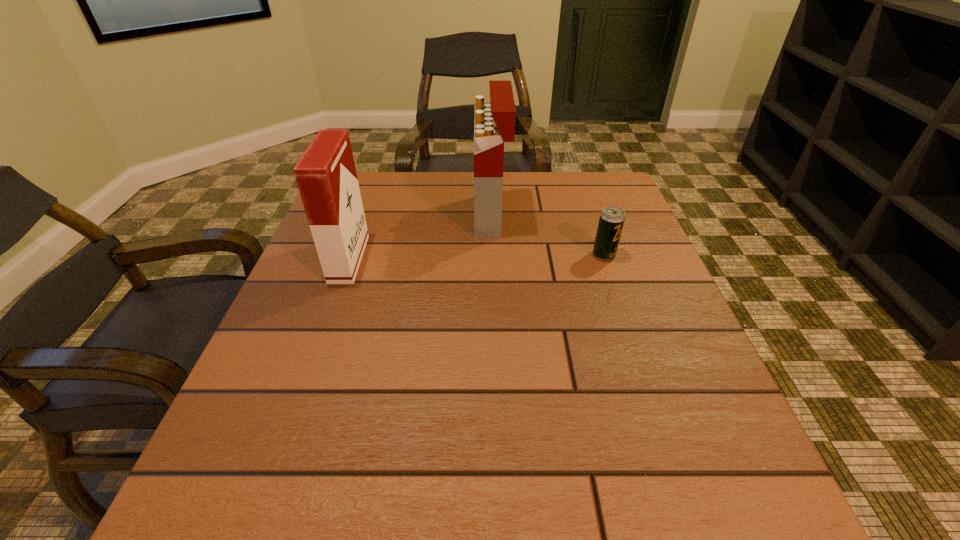
I want to click on the right cigarette_case, so click(x=494, y=124).

Find the location of `the leftmost object`. the leftmost object is located at coordinates (326, 176).

Identify the location of the rightmost object. (611, 221).

You are a GUI agent. You are given a task and a screenshot of the screen. Output one action in this format:
    pyautogui.click(x=<x>, y=<y>)
    Task: Click on the beer can
    The width and height of the screenshot is (960, 540).
    Given the screenshot: What is the action you would take?
    pyautogui.click(x=611, y=221)

The height and width of the screenshot is (540, 960). What are the coordinates of `blank area located with the lid open on the second object from left to right` in the screenshot? It's located at (326, 216).

Locate an element on the screen. vacant space located 0.080m with the lid open on the second object from left to right is located at coordinates 442,216.

Where is `free space located with the lid open on the second object from left to right`? free space located with the lid open on the second object from left to right is located at coordinates (413, 216).

In order to click on vacant space located on the front-facing side of the leftmost object in this screenshot , I will do `click(469, 259)`.

Identify the location of free space located 0.100m on the back of the beer can. Image resolution: width=960 pixels, height=540 pixels. (593, 222).

In order to click on object that is at the far edge in this screenshot , I will do `click(494, 124)`.